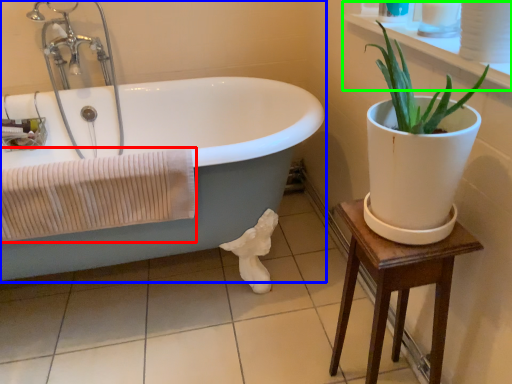
Question: Which object is positioned closest to bath towel (highlighted by a red box)? Select from bathtub (highlighted by a blue box) and window sill (highlighted by a green box).

Choices:
 (A) bathtub
 (B) window sill

Answer: (A)